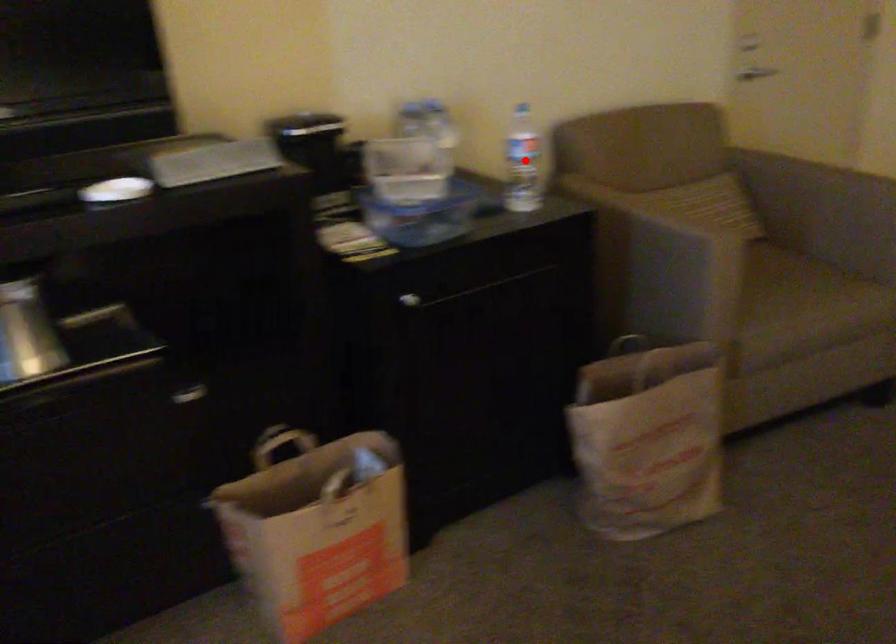
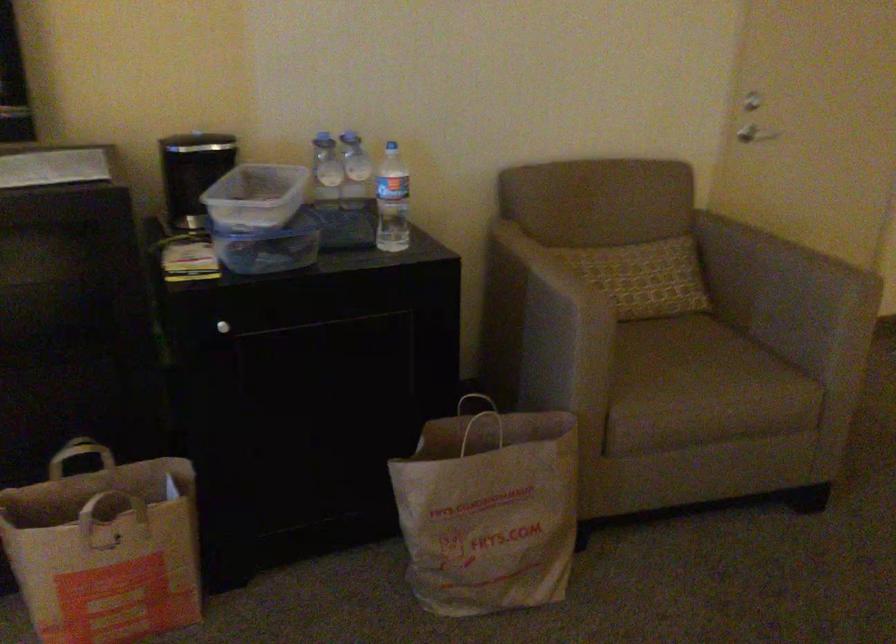
Where in the second image is the point corresponding to the highlighted location from the first image?

(391, 201)